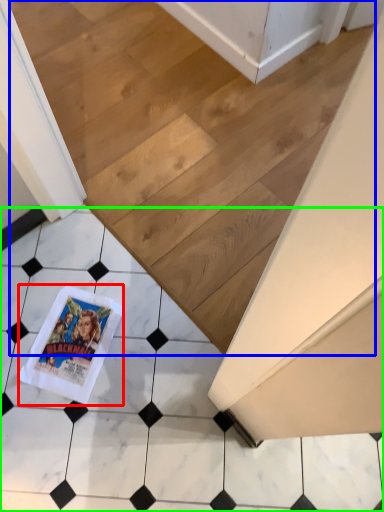
Question: Which is farther away from comic book (highlighted by a red box)? stairwell (highlighted by a blue box) or tile (highlighted by a green box)?

Choices:
 (A) stairwell
 (B) tile

Answer: (A)